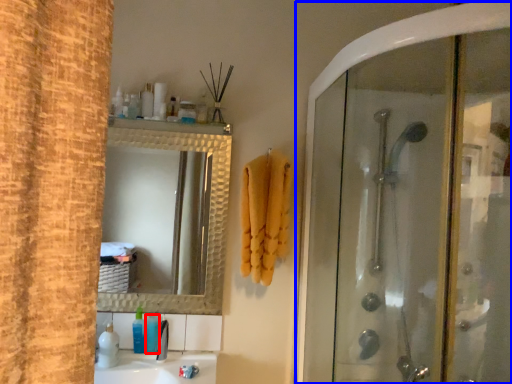
Question: Which point is closer to the camera, toiletry (highlighted by a red box) or screen door (highlighted by a blue box)?

Choices:
 (A) toiletry
 (B) screen door

Answer: (B)